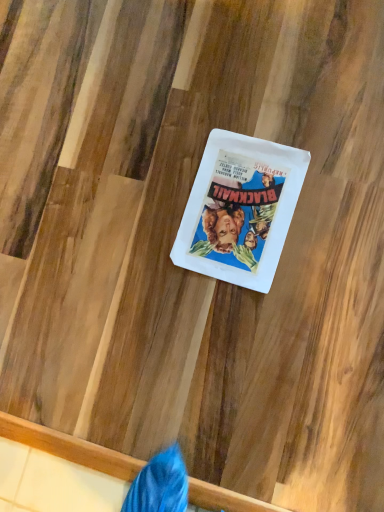
The height and width of the screenshot is (512, 384). What are the coordinates of `free point below white paper at center (from a real-world perspective)` in the screenshot? It's located at pyautogui.click(x=237, y=210).